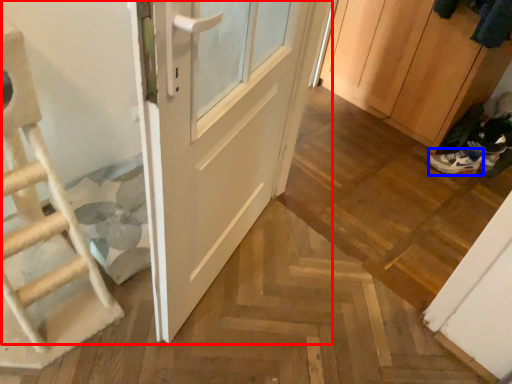
Question: Which object is further to the camera taking this photo, door (highlighted by a red box) or footwear (highlighted by a blue box)?

Choices:
 (A) door
 (B) footwear

Answer: (B)